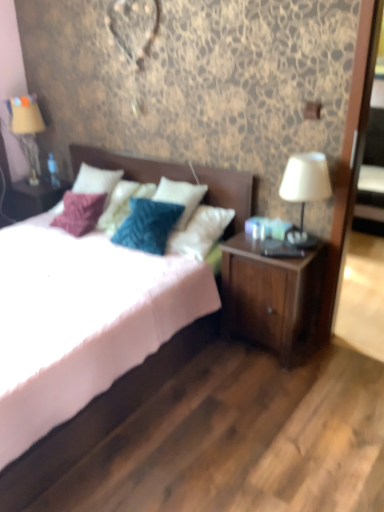
Where is `vacant space to the left of wooden nightstand at lower right`? vacant space to the left of wooden nightstand at lower right is located at coordinates tap(206, 359).